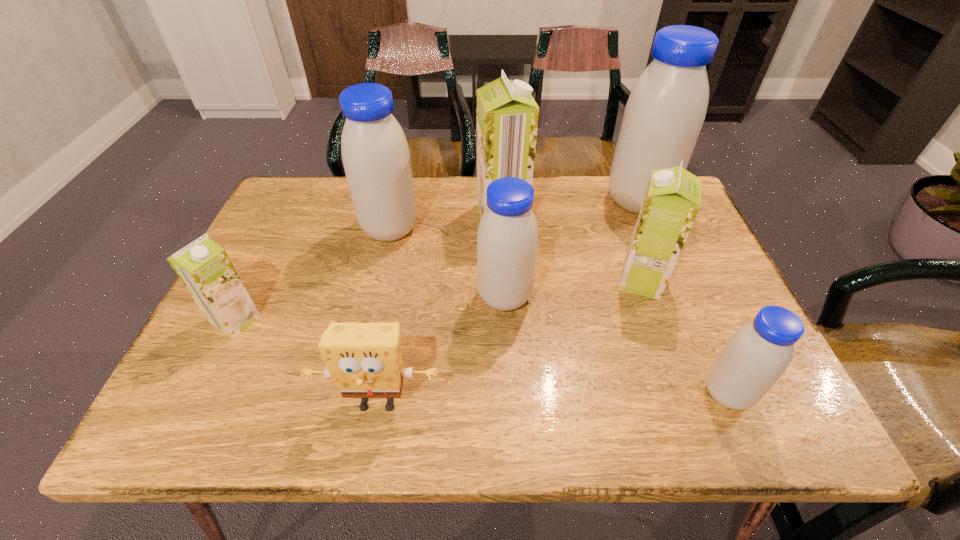
Locate an element on the screen. This screenshot has width=960, height=540. the smallest green soya milk is located at coordinates (203, 266).

You are a GUI agent. You are given a task and a screenshot of the screen. Output one action in this format:
    pyautogui.click(x=<x>, y=<y>)
    Task: Click on the leftmost green soya milk
    This screenshot has width=960, height=540.
    Given the screenshot: What is the action you would take?
    pyautogui.click(x=203, y=266)

This screenshot has width=960, height=540. I want to click on the nearest blue soya milk, so click(758, 353).

The width and height of the screenshot is (960, 540). I want to click on the nearest soya milk, so click(758, 353).

Where is `sponge`? This screenshot has width=960, height=540. sponge is located at coordinates (364, 360).

Where is `vacant space located 0.270m on the front of the biggest blue soya milk`? This screenshot has width=960, height=540. vacant space located 0.270m on the front of the biggest blue soya milk is located at coordinates (676, 296).

I want to click on vacant region located 0.110m on the left of the leftmost blue soya milk, so click(320, 229).

Find the location of a particular element. vacant space situated on the right of the second green soya milk from right to left is located at coordinates (566, 215).

This screenshot has height=540, width=960. What are the coordinates of `vacant region located on the left of the second smallest green soya milk` in the screenshot? It's located at (511, 281).

Identify the location of vacant area situated on the left of the second nearest blue soya milk. (417, 297).